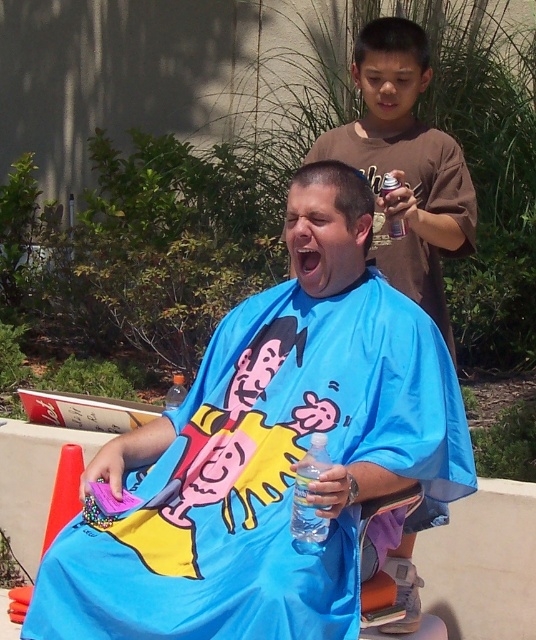
Is blue fabric cape at center to the right of brown cotton shirt at upper right from the viewer's perspective?

No, blue fabric cape at center is not to the right of brown cotton shirt at upper right.

Does blue fabric cape at center lie behind brown cotton shirt at upper right?

That is False.

What do you see at coordinates (269, 452) in the screenshot? The image size is (536, 640). I see `blue fabric cape at center` at bounding box center [269, 452].

At what (x,y) coordinates should I click in order to perform the action: click on blue fabric cape at center. Please return your answer as a coordinate pair (x, y). Looking at the image, I should click on (269, 452).